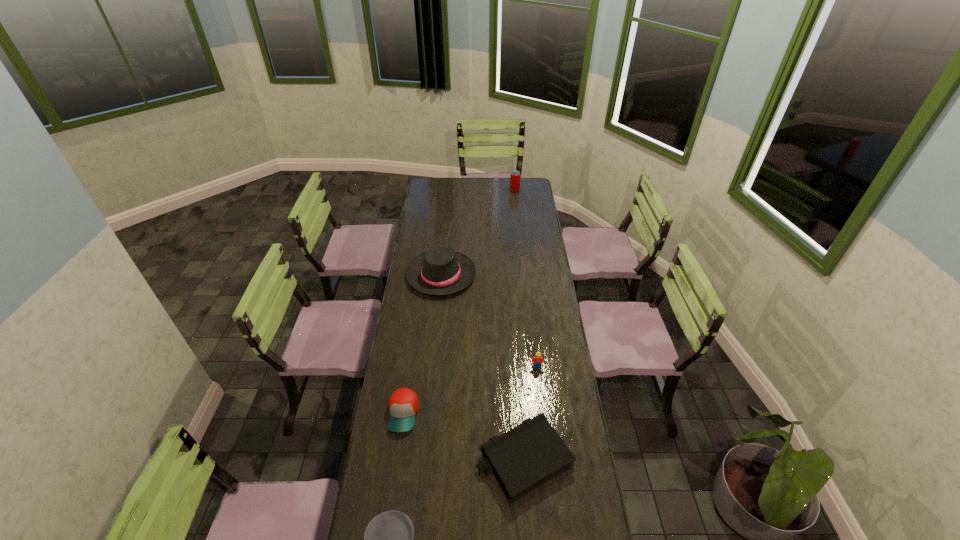
Where is `the farthest object`? Image resolution: width=960 pixels, height=540 pixels. the farthest object is located at coordinates (515, 177).

You are a GUI agent. You are given a task and a screenshot of the screen. Output one action in this format:
    pyautogui.click(x=<x>, y=<y>)
    Task: Click on the second farthest object
    The image size is (960, 540).
    Given the screenshot: What is the action you would take?
    pyautogui.click(x=441, y=271)

Find the location of a particular element. the third tallest object is located at coordinates (537, 359).

Identify the location of Lego. (537, 359).

Locate an element on the screen. baseball cap is located at coordinates (403, 405).

The image size is (960, 540). In order to click on Bible in this screenshot , I will do `click(525, 457)`.

Image resolution: width=960 pixels, height=540 pixels. What are the coordinates of `vacant space located 0.050m on the right of the beer can` in the screenshot? It's located at (528, 190).

What are the coordinates of `free space located 0.180m on the right of the dress hat` in the screenshot? It's located at (512, 275).

Identify the location of vacant space located 0.140m on the face of the Lego. (540, 400).

Where is `vacant region located at the brim of the baseball cap`? The width and height of the screenshot is (960, 540). vacant region located at the brim of the baseball cap is located at coordinates (390, 509).